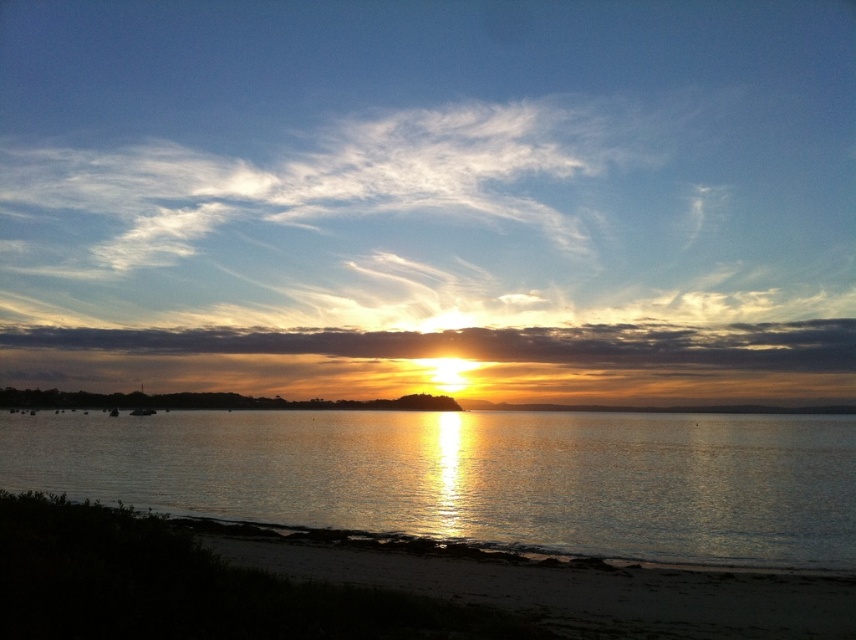
Question: Does glistening water at center have a lesser width compared to sandy beach at lower left?

Choices:
 (A) yes
 (B) no

Answer: (B)

Question: Is glistening water at center positioned at the back of sandy beach at lower left?

Choices:
 (A) no
 (B) yes

Answer: (B)

Question: Among these points, which one is farthest from the camera?

Choices:
 (A) (503, 616)
 (B) (646, 452)

Answer: (B)

Question: Which of the following is the farthest from the observer?

Choices:
 (A) sandy beach at lower left
 (B) glistening water at center

Answer: (B)

Question: Which point is farther from the camera taking this photo?

Choices:
 (A) (126, 525)
 (B) (224, 481)

Answer: (B)

Question: Can you confirm if glistening water at center is positioned to the right of sandy beach at lower left?

Choices:
 (A) yes
 (B) no

Answer: (B)